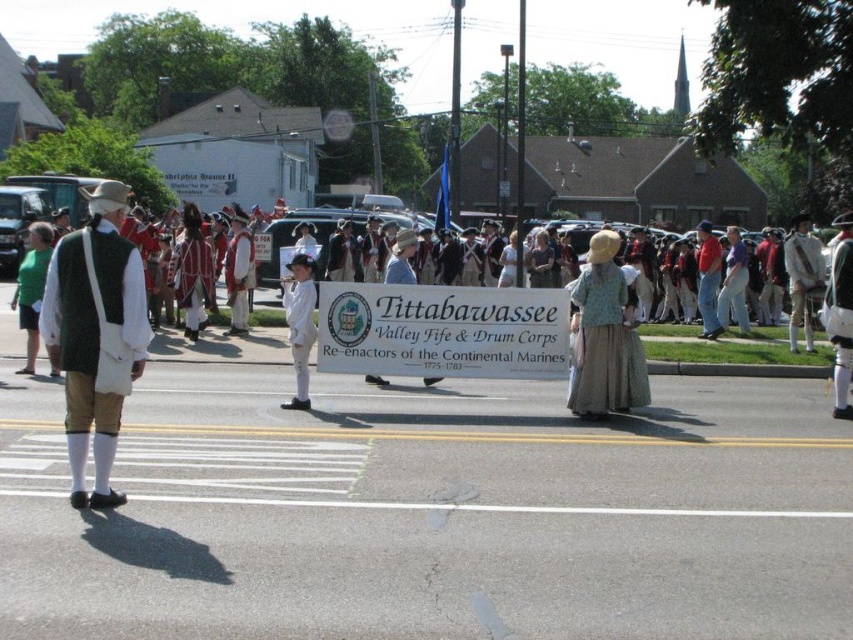
What is the spatial relationship between the light blue fabric dress at center and the other objects in the scene?

The light blue fabric dress at center is positioned at coordinates approximately 0.527 on the x axis and 0.712 on the y axis.

You are a costume designer analyzing the clothing in the image. You need to determine which garment has a narrower width between the green wool vest at left and the white linen shirt at center. Which one is narrower?

The green wool vest at left is thinner than the white linen shirt at center, so the green wool vest at left has a narrower width.